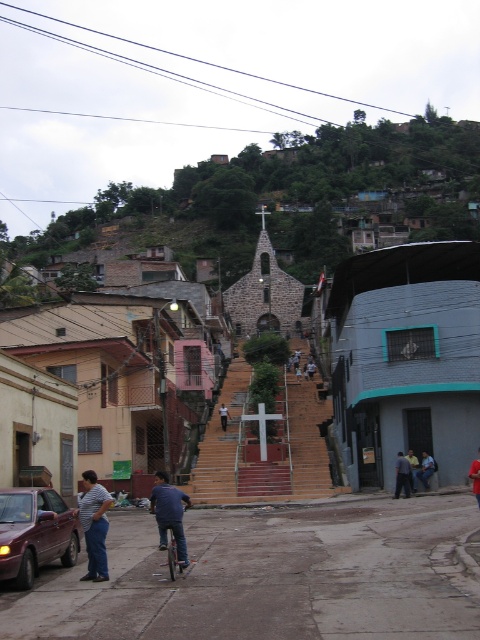
Question: Which of the following is the closest to the observer?

Choices:
 (A) stone church at center
 (B) striped shirt at lower left
 (C) metallic silver bicycle at center
 (D) red shirt at center

Answer: (B)

Question: Which point is closer to the camera?

Choices:
 (A) (478, 500)
 (B) (29, 586)
 (C) (400, 465)
 (D) (411, 480)

Answer: (B)

Question: Which object is closer to the camera taking this photo?

Choices:
 (A) blue jeans at lower center
 (B) dark blue jeans at center
 (C) dark blue shirt at lower right
 (D) matte red car at lower left

Answer: (D)

Question: Does stone church at center appear on the right side of striped shirt at lower left?

Choices:
 (A) yes
 (B) no

Answer: (A)

Question: Is matte red car at lower left positioned before blue denim jeans at lower right?

Choices:
 (A) no
 (B) yes

Answer: (B)

Question: Does striped shirt at lower left have a smaller size compared to blue jeans at lower center?

Choices:
 (A) yes
 (B) no

Answer: (B)